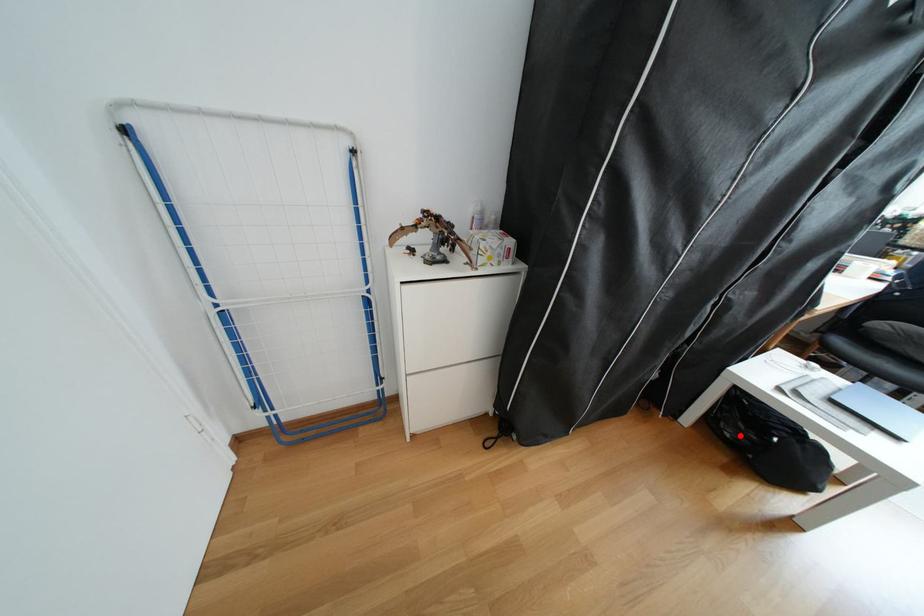
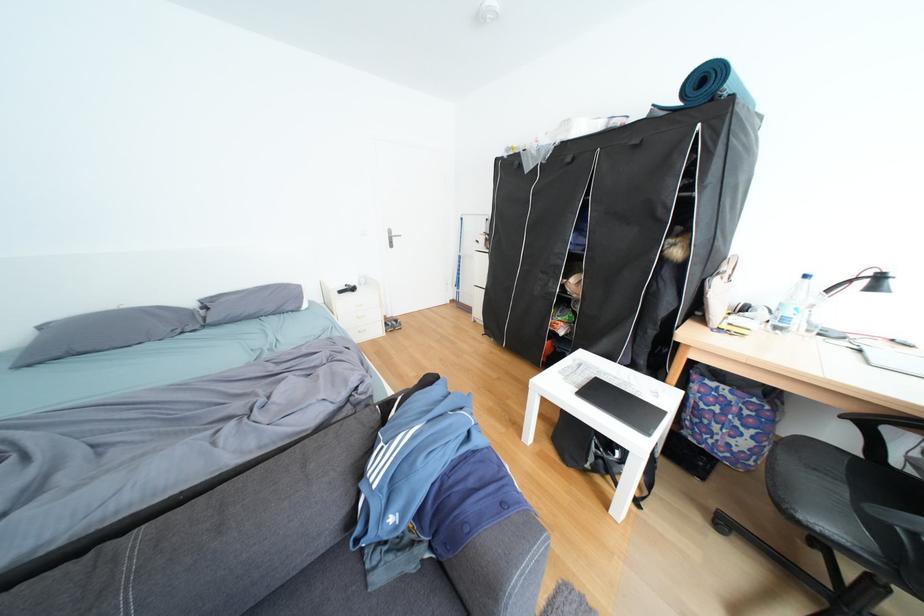
Question: I am providing you with two images of the same scene from different viewpoints. A red point is marked on the first image. Can you still see the location of the red point in image 2?

Choices:
 (A) Yes
 (B) No

Answer: (B)